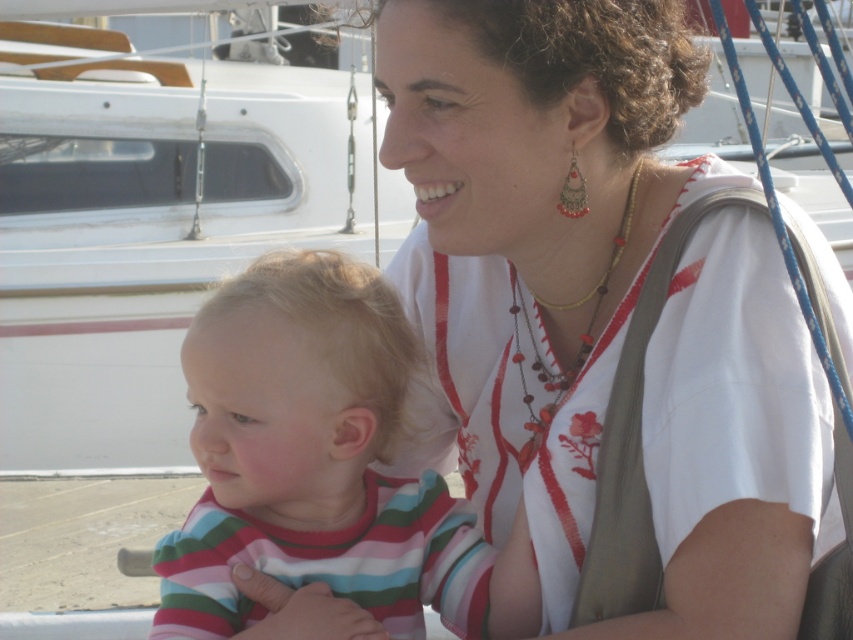
Does striped cotton shirt at center appear on the left side of multicolored beaded necklace at upper center?

Indeed, striped cotton shirt at center is positioned on the left side of multicolored beaded necklace at upper center.

In the scene shown: Between striped cotton shirt at center and multicolored beaded necklace at upper center, which one has more height?

Standing taller between the two is striped cotton shirt at center.

Measure the distance between point [265,512] and camera.

The distance of point [265,512] from camera is 2.90 meters.

Where is `striped cotton shirt at center`? This screenshot has width=853, height=640. striped cotton shirt at center is located at coordinates (320, 465).

Is white plastic boat at upper center above multicolored beaded necklace at upper center?

Indeed, white plastic boat at upper center is positioned over multicolored beaded necklace at upper center.

The image size is (853, 640). In order to click on white plastic boat at upper center in this screenshot , I will do click(x=144, y=224).

You are a GUI agent. You are given a task and a screenshot of the screen. Output one action in this format:
    pyautogui.click(x=<x>, y=<y>)
    Task: Click on the white plastic boat at upper center
    The width and height of the screenshot is (853, 640).
    Given the screenshot: What is the action you would take?
    pyautogui.click(x=144, y=224)

Who is shorter, white embroidered shirt at upper center or white plastic boat at upper center?

white embroidered shirt at upper center

Based on the photo, between white embroidered shirt at upper center and white plastic boat at upper center, which one appears on the left side from the viewer's perspective?

From the viewer's perspective, white plastic boat at upper center appears more on the left side.

Measure the distance between point (x=460, y=61) and camera.

They are 2.63 meters apart.

Identify the location of white embroidered shirt at upper center. The height and width of the screenshot is (640, 853). (532, 224).